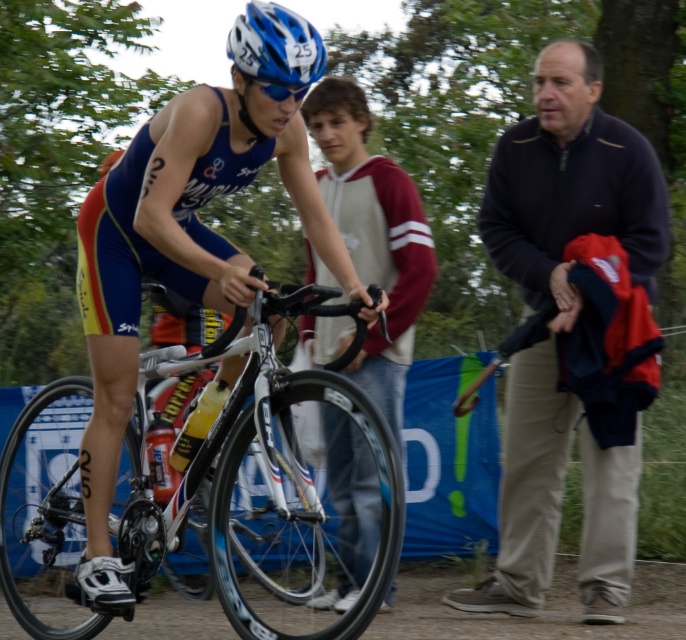
Question: Is dark blue sweater at right smaller than white glossy bicycle at center?

Choices:
 (A) no
 (B) yes

Answer: (A)

Question: Which point appears closest to the camera in this image?

Choices:
 (A) (496, 156)
 (B) (233, 54)
 (C) (405, 580)
 (D) (378, 552)

Answer: (D)

Question: Is dark blue sweater at right to the left of white glossy bicycle at center from the viewer's perspective?

Choices:
 (A) yes
 (B) no

Answer: (B)

Question: Which point is closer to the camera taking this photo?

Choices:
 (A) (495, 621)
 (B) (270, 16)
 (C) (622, 122)

Answer: (B)

Question: Which point is closer to the camera taking this photo?

Choices:
 (A) (571, 246)
 (B) (639, 563)

Answer: (A)

Question: Can you confirm if blue matte triathlon suit at center is smaller than dirt track at lower center?

Choices:
 (A) no
 (B) yes

Answer: (A)